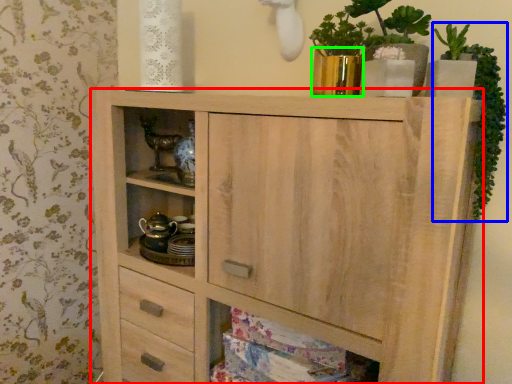
Question: Estimate the real-world distances between objects in this image. Which object is farther from chest of drawers (highlighted by a red box), plant (highlighted by a blue box) or glass vase (highlighted by a green box)?

Choices:
 (A) plant
 (B) glass vase

Answer: (A)